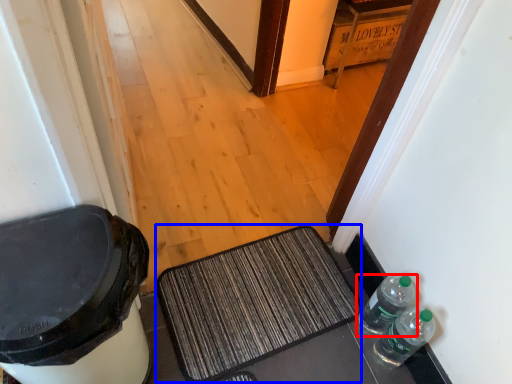
Question: Which object appears farthest to the camera in this image, bottle (highlighted by a red box) or doormat (highlighted by a blue box)?

Choices:
 (A) bottle
 (B) doormat

Answer: (B)